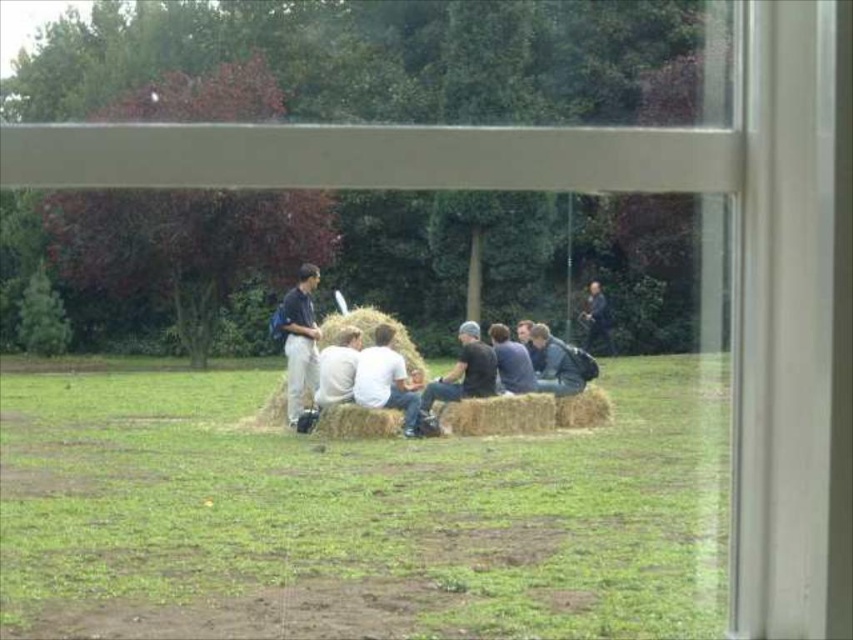
Does light brown straw bale at center appear over dark blue leather jacket at center?

Yes, light brown straw bale at center is above dark blue leather jacket at center.

How distant is light brown straw bale at center from dark blue leather jacket at center?

2.03 meters

Which is behind, point (341, 324) or point (573, 358)?

Point (573, 358)

Find the location of `light brown straw bale at center`. light brown straw bale at center is located at coordinates (372, 333).

Is dark gray knit cap at center bigger than dark blue leather jacket at center?

Yes, dark gray knit cap at center is bigger than dark blue leather jacket at center.

How much distance is there between dark gray knit cap at center and dark blue leather jacket at center?

dark gray knit cap at center is 1.31 meters away from dark blue leather jacket at center.

Identify the location of dark gray knit cap at center. (462, 374).

The width and height of the screenshot is (853, 640). Identify the location of dark gray knit cap at center. (462, 374).

Does green grass at center have a lesser height compared to white matte shirt at center?

Yes, green grass at center is shorter than white matte shirt at center.

Does point (722, 589) lie behind point (384, 326)?

That is False.

You are a GUI agent. You are given a task and a screenshot of the screen. Output one action in this format:
    pyautogui.click(x=<x>, y=<y>)
    Task: Click on the green grass at center
    
    Given the screenshot: What is the action you would take?
    pyautogui.click(x=358, y=515)